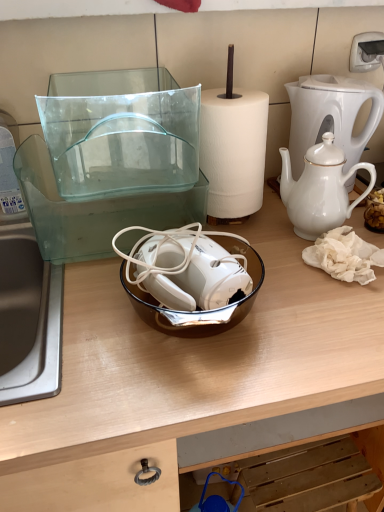
In order to click on vacant space situated on the left part of brown glass bowl at center in this screenshot , I will do `click(88, 319)`.